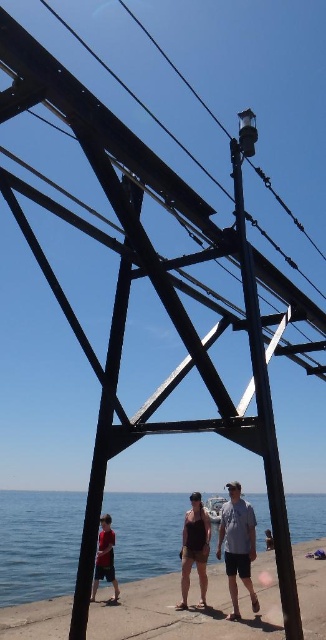
Question: In this image, where is light blue denim shorts at center located relative to light brown wooden boardwalk at lower center?

Choices:
 (A) above
 (B) below

Answer: (A)

Question: Estimate the real-world distances between objects in this image. Which object is farther from the dark brown tank top at center?

Choices:
 (A) black metal pole at center
 (B) matte red shirt at lower left
 (C) light blue denim shorts at center
 (D) light brown wooden boardwalk at lower center

Answer: (D)

Question: Among these objects, which one is nearest to the camera?

Choices:
 (A) light blue denim shorts at center
 (B) light brown wooden boardwalk at lower center
 (C) dark brown tank top at center
 (D) blue water at lower center

Answer: (A)

Question: Which point is farther to the camera?

Choices:
 (A) light brown wooden boardwalk at lower center
 (B) blue water at lower center
 (C) black metal power line at upper center
 (D) light blue denim shorts at center

Answer: (A)

Question: Is blue water at lower center to the left of dark brown tank top at center from the viewer's perspective?

Choices:
 (A) no
 (B) yes

Answer: (B)

Question: Is black metal pole at center to the left of matte red shirt at lower left from the viewer's perspective?

Choices:
 (A) no
 (B) yes

Answer: (A)